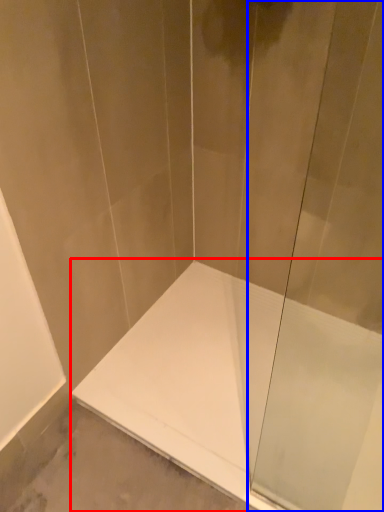
Question: Which object appears closest to the camera in this image, bathtub (highlighted by a red box) or shower door (highlighted by a blue box)?

Choices:
 (A) bathtub
 (B) shower door

Answer: (B)